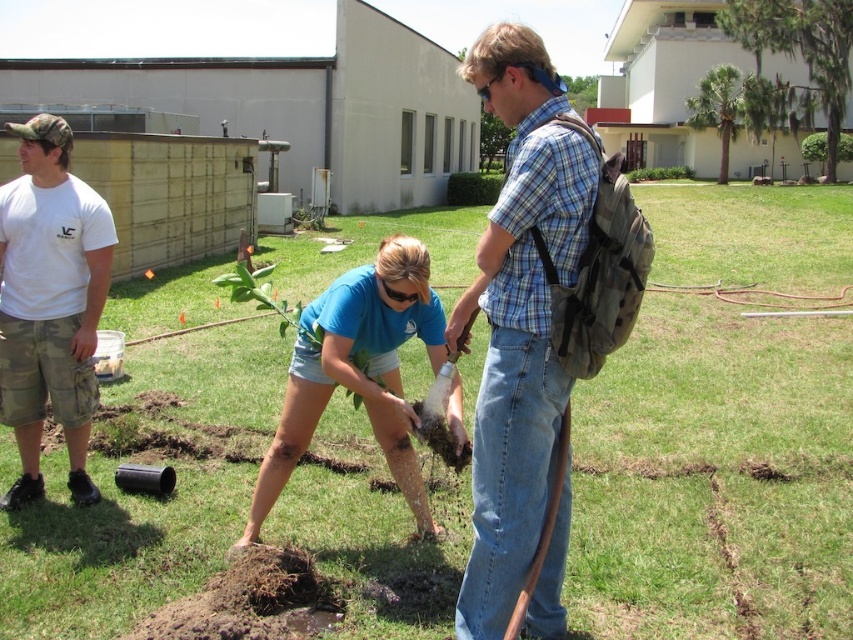
Question: Which of the following is the closest to the observer?

Choices:
 (A) (512, 230)
 (B) (428, 337)

Answer: (A)

Question: Estimate the real-world distances between objects in this image. Which object is farther from the green leafy plant at center?

Choices:
 (A) blue plaid shirt at center
 (B) camo shorts at left
 (C) blue cotton shirt at center

Answer: (B)

Question: Considering the relative positions of green leafy tree at upper right and green leafy plant at center in the image provided, where is green leafy tree at upper right located with respect to green leafy plant at center?

Choices:
 (A) above
 (B) below

Answer: (A)

Question: Does blue plaid shirt at center come in front of camo shorts at left?

Choices:
 (A) yes
 (B) no

Answer: (A)

Question: Where is blue plaid shirt at center located in relation to camo shorts at left in the image?

Choices:
 (A) right
 (B) left

Answer: (A)

Question: Which object appears closest to the camera in this image?

Choices:
 (A) green leafy plant at center
 (B) blue cotton shirt at center
 (C) green leafy palm tree at upper right
 (D) green leafy tree at upper right

Answer: (B)